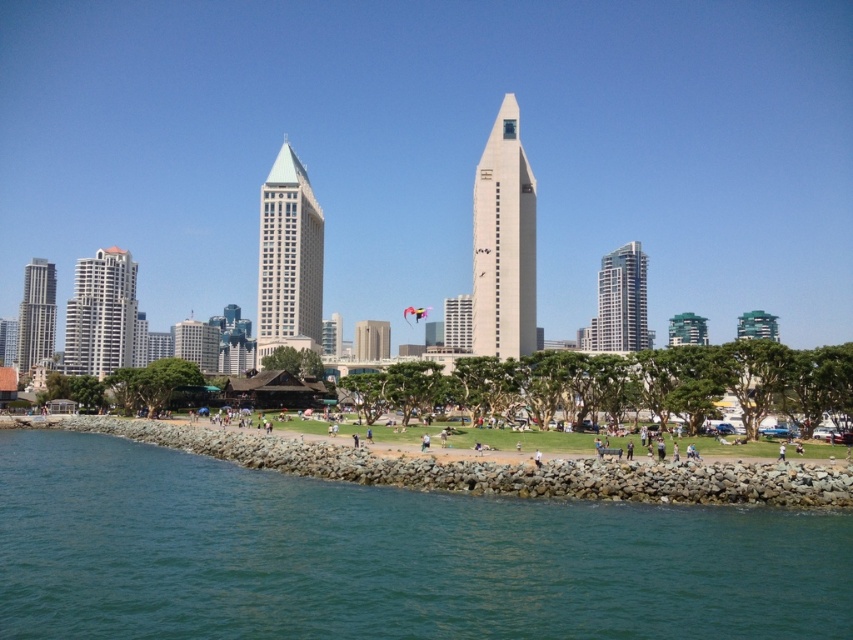
Question: Does matte glass skyscraper at left have a lesser width compared to smooth beige tower at center?

Choices:
 (A) yes
 (B) no

Answer: (B)

Question: Which object is farther from the camera taking this photo?

Choices:
 (A) matte glass skyscraper at center
 (B) matte glass skyscraper at left

Answer: (B)

Question: Which of the following is the closest to the observer?

Choices:
 (A) (x=286, y=157)
 (B) (x=74, y=268)
 (C) (x=497, y=237)
 (D) (x=619, y=476)

Answer: (D)

Question: Is green water at lower left further to the viewer compared to matte glass building at left?

Choices:
 (A) no
 (B) yes

Answer: (A)

Question: Can you confirm if rocky shore at lower center is smaller than matte glass skyscraper at left?

Choices:
 (A) no
 (B) yes

Answer: (B)

Question: Which of the following is the farthest from the observer?

Choices:
 (A) (120, 324)
 (B) (22, 292)

Answer: (B)